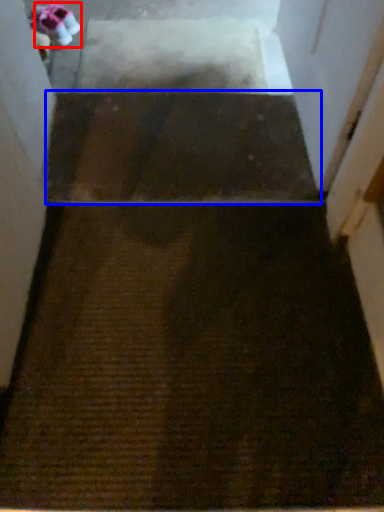
Question: Which object appears closest to the camera in this image, shoe (highlighted by a red box) or stairwell (highlighted by a blue box)?

Choices:
 (A) shoe
 (B) stairwell

Answer: (B)